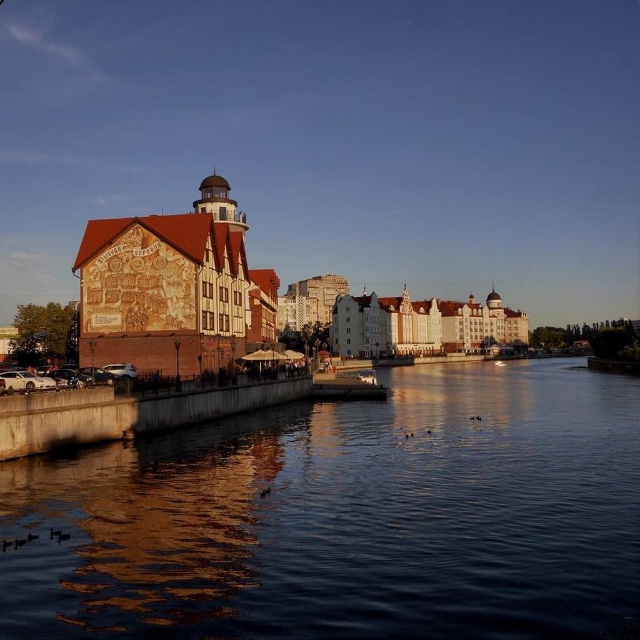
Does dark water at center lie in front of brick building at left?

Yes, it is in front of brick building at left.

Is dark water at center further to the viewer compared to brick building at left?

No, it is in front of brick building at left.

Who is more distant from viewer, (572, 525) or (236, 216)?

Point (236, 216)

Where is `dark water at center`? Image resolution: width=640 pixels, height=640 pixels. dark water at center is located at coordinates (346, 518).